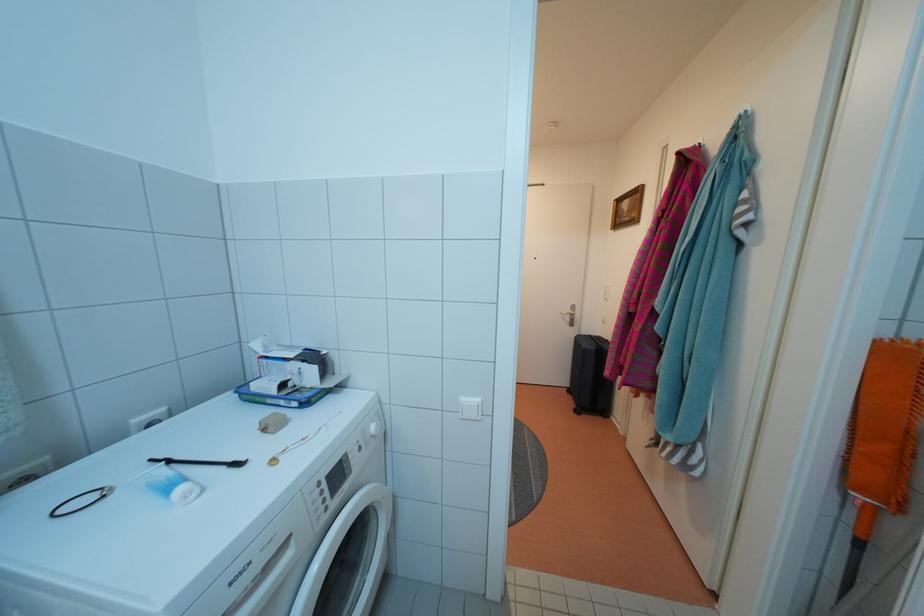
Describe the element at coordinates (377, 428) in the screenshot. I see `the washing machine button` at that location.